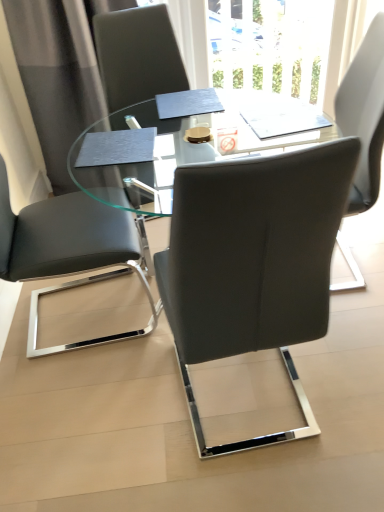
At what (x,y) coordinates should I click in order to perform the action: click on free space underneath matte gray chair at center, which is the 1th chair from right to left (from a real-world perspective). Please return your answer as a coordinate pair (x, y). Looking at the image, I should click on (247, 402).